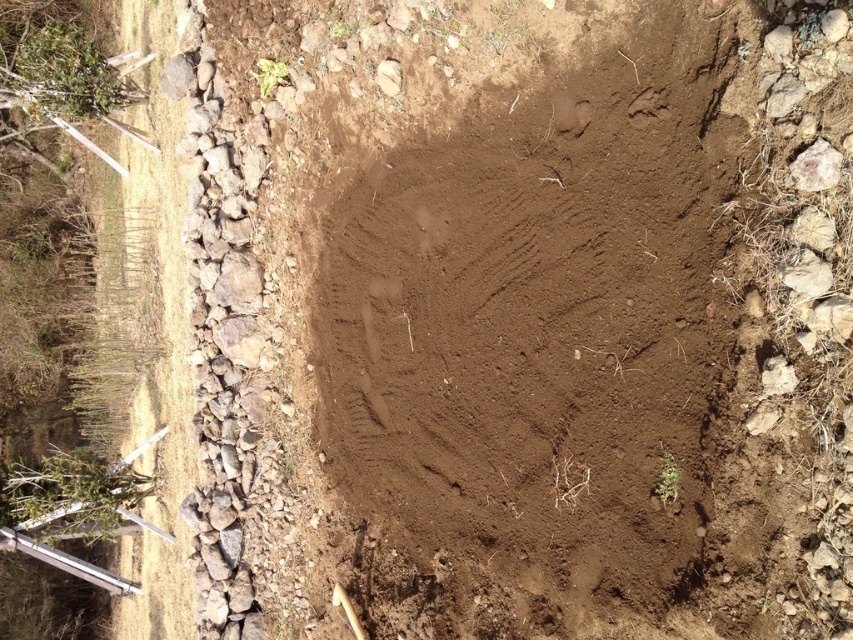
You are standing at the edge of the hole and want to place a small flag at the point that is closer to the camera between point (532, 320) and point (828, 276). Which point should you choose?

You should choose point (828, 276) because it is closer to the camera than point (532, 320).

You are a gardener planning to place a decorative rock in the hole. You have a brown rough rock at upper right. Will placing it in the brown soil at center block your view of the rock from the front of the hole?

The brown rough rock at upper right is behind the brown soil at center, so placing it in the hole would block your view of the rock from the front of the hole.